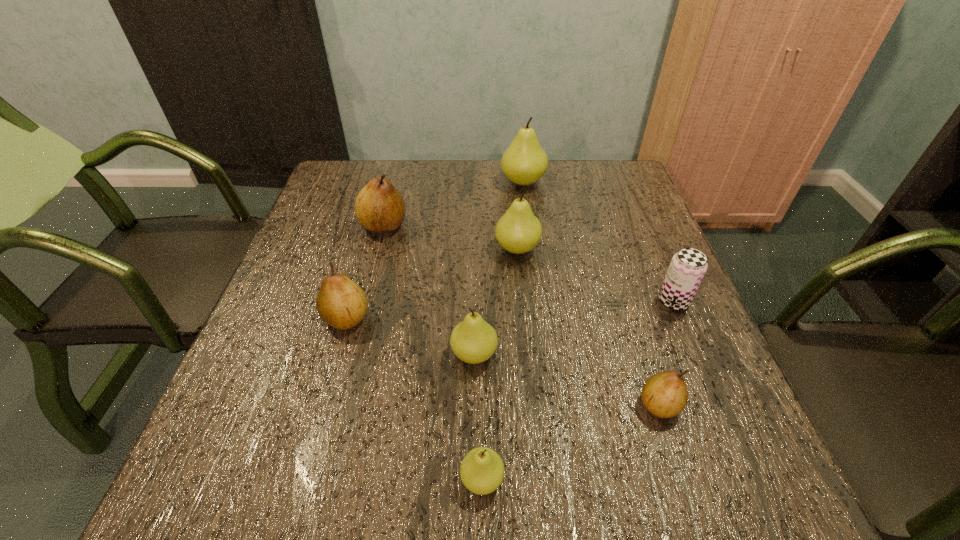
In order to click on the tallest object in this screenshot , I will do (x=524, y=162).

Find the location of a particular element. the biggest green pear is located at coordinates (524, 162).

Locate an element on the screen. the biggest brown pear is located at coordinates (379, 207).

The image size is (960, 540). In order to click on the second farthest green pear in this screenshot , I will do `click(518, 231)`.

Image resolution: width=960 pixels, height=540 pixels. In order to click on the third biggest green pear in this screenshot , I will do `click(473, 340)`.

The width and height of the screenshot is (960, 540). Identify the location of the second nearest brown pear. (341, 303).

This screenshot has height=540, width=960. I want to click on purple beer can, so click(688, 266).

Image resolution: width=960 pixels, height=540 pixels. I want to click on beer can, so click(x=688, y=266).

This screenshot has height=540, width=960. I want to click on the nearest brown pear, so click(x=664, y=394).

Find the location of a particular element. The height and width of the screenshot is (540, 960). the second nearest pear is located at coordinates (664, 394).